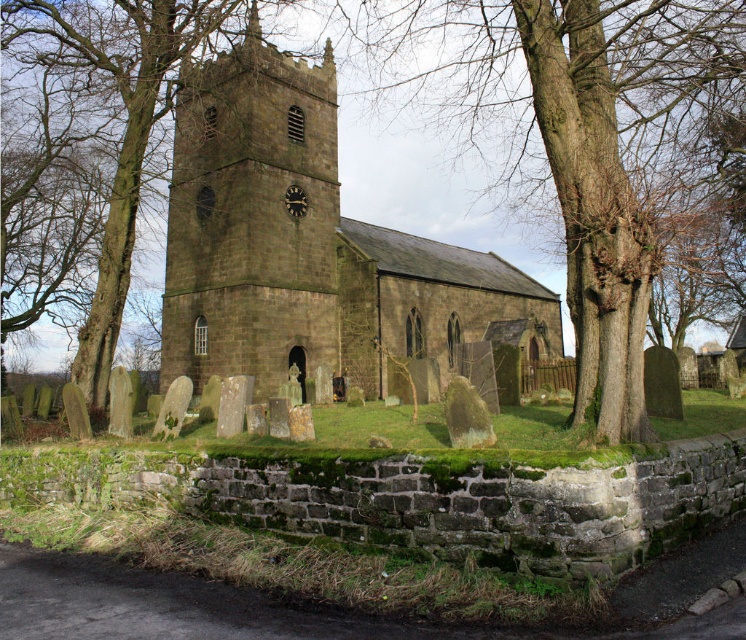
Question: Which point is closer to the camera?

Choices:
 (A) (201, 273)
 (B) (266, 67)
 (C) (84, 353)

Answer: (C)

Question: Which object appears closest to the camera in this image?

Choices:
 (A) dark brown stone church tower at center
 (B) brown textured tree at left

Answer: (B)

Question: Does brown rough tree at center lie in front of dark brown stone church at center?

Choices:
 (A) no
 (B) yes

Answer: (B)

Question: Which of the following is the closest to the observer?

Choices:
 (A) dark brown stone church tower at center
 (B) brown textured tree at left
 (C) dark brown stone church at center

Answer: (C)

Question: Does dark brown stone church at center appear on the left side of black stone clock at center?

Choices:
 (A) no
 (B) yes

Answer: (A)

Question: Is dark brown stone church at center behind brown textured tree at left?

Choices:
 (A) yes
 (B) no

Answer: (B)